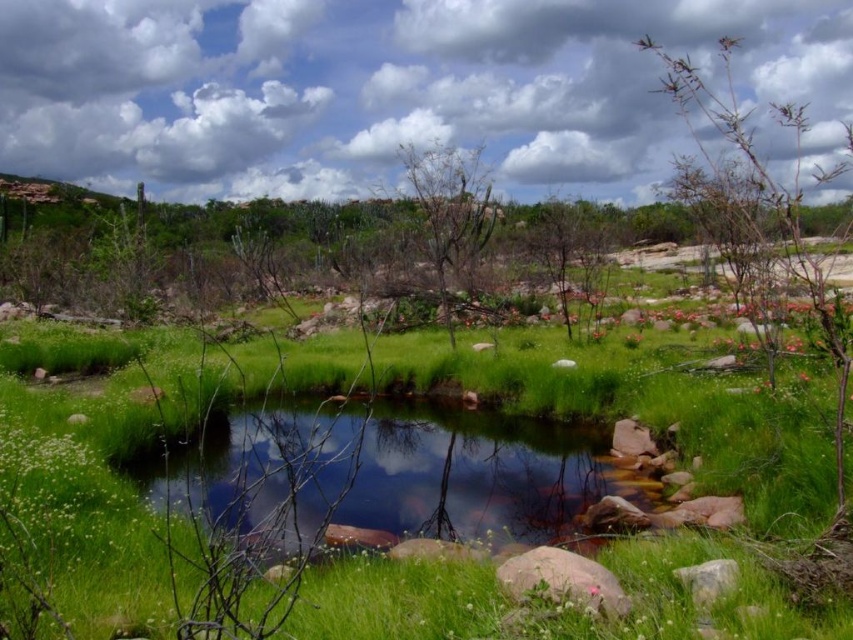
You are standing near the edge of the pond and want to place a small decorative item on the surface. The item requires a spot that is wider than the smooth pink rock at lower center. Can the clear water at center provide such a spot?

The clear water at center might be wider than the smooth pink rock at lower center, so it could potentially provide a suitable spot for the decorative item.

You are standing at the edge of the pond and want to take a photo. There are two points marked in the image, point 1 at coordinates point (456,156) and point 2 at coordinates point (735,582). Which point should you focus on to ensure the closer one is in sharp focus?

You should focus on point (456,156) because it is closer to the camera than point (735,582).